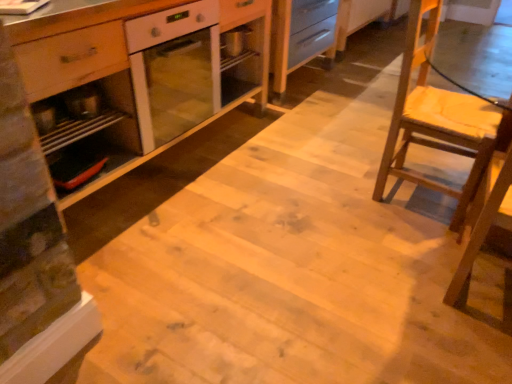
Question: Based on their sizes in the image, would you say metallic silver tray at left is bigger or smaller than wooden chair at right?

Choices:
 (A) big
 (B) small

Answer: (B)

Question: Is point (89, 102) closer or farther from the camera than point (424, 115)?

Choices:
 (A) closer
 (B) farther

Answer: (A)

Question: Which is farther from the metallic silver tray at left?

Choices:
 (A) white glossy oven at center
 (B) wooden chair at right

Answer: (B)

Question: Estimate the real-world distances between objects in this image. Which object is farther from the white glossy oven at center?

Choices:
 (A) wooden chair at right
 (B) metallic silver tray at left

Answer: (A)